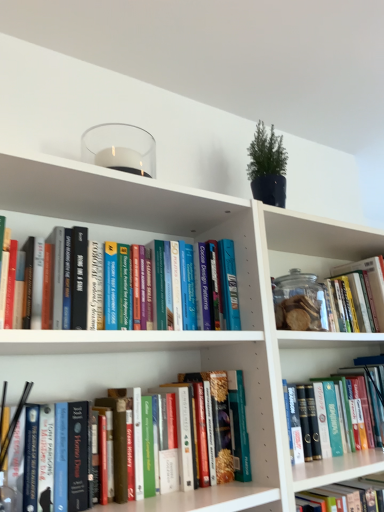
Measure the distance between hardcover book at center, which ranks as the third book in top-to-bottom order, and camera.

33.14 inches.

Locate an element on the screen. The height and width of the screenshot is (512, 384). hardcover book at lower right, which appears as the fifth book when viewed from the top is located at coordinates (352, 494).

Find the location of a particular element. white matte bookcase at upper center is located at coordinates (191, 331).

In order to face transparent glass jar at upper right, which is the second book in top-to-bottom order, should I rotate leftwards or rightwards?

You should rotate right by 18.265 degrees.

Locate an element on the screen. The height and width of the screenshot is (512, 384). hardcover book at center, positioned as the second book in bottom-to-top order is located at coordinates (313, 362).

The width and height of the screenshot is (384, 512). I want to click on hardcover book at center, which ranks as the third book in top-to-bottom order, so click(x=198, y=499).

Which is behind, hardcover book at lower right, which appears as the fifth book when viewed from the top, or transparent glass jar at upper right, the 4th book when ordered from bottom to top?

transparent glass jar at upper right, the 4th book when ordered from bottom to top, is behind.

From the image's perspective, which object appears higher, hardcover book at lower right, arranged as the 1th book when ordered from the bottom, or transparent glass jar at upper right, which is the second book in top-to-bottom order?

transparent glass jar at upper right, which is the second book in top-to-bottom order, from the image's perspective.

Does point (365, 497) come closer to viewer compared to point (310, 264)?

Yes.

Could you tell me if hardcover book at lower right, which appears as the fifth book when viewed from the top, is facing transparent glass jar at upper right, the 4th book when ordered from bottom to top?

No.

Is hardcover book at center, which is counted as the 4th book, starting from the top, wider or thinner than transparent glass jar at upper right, the 4th book when ordered from bottom to top?

Clearly, hardcover book at center, which is counted as the 4th book, starting from the top, has less width compared to transparent glass jar at upper right, the 4th book when ordered from bottom to top.

From a real-world perspective, starting from the transparent glass jar at upper right, the 4th book when ordered from bottom to top, which book is the 1st one below it? Please provide its 2D coordinates.

[(313, 362)]

In the scene shown: Which object is closer to the camera, hardcover book at center, which is counted as the 4th book, starting from the top, or transparent glass jar at upper right, the 4th book when ordered from bottom to top?

hardcover book at center, which is counted as the 4th book, starting from the top, is closer to the camera.

Is hardcover book at center, positioned as the second book in bottom-to-top order, far away from transparent glass jar at upper right, which is the second book in top-to-bottom order?

No, hardcover book at center, positioned as the second book in bottom-to-top order, is in close proximity to transparent glass jar at upper right, which is the second book in top-to-bottom order.

From a real-world perspective, which object rests below the other?

hardcover book at center, which ranks as the third book in top-to-bottom order, from a real-world perspective.

Consider the image. Is hardcover book at center, placed as the third book when sorted from bottom to top, aimed at white matte bookcase at upper center?

Yes, hardcover book at center, placed as the third book when sorted from bottom to top, faces towards white matte bookcase at upper center.

Is hardcover book at center, placed as the third book when sorted from bottom to top, far from white matte bookcase at upper center?

That's not correct — hardcover book at center, placed as the third book when sorted from bottom to top, is a little close to white matte bookcase at upper center.

Is hardcover book at center, which ranks as the third book in top-to-bottom order, bigger or smaller than white matte bookcase at upper center?

In the image, hardcover book at center, which ranks as the third book in top-to-bottom order, appears to be smaller than white matte bookcase at upper center.

You are a GUI agent. You are given a task and a screenshot of the screen. Output one action in this format:
    pyautogui.click(x=<x>, y=<y>)
    Task: Click on the 3rd book located beneath the white matte bookcase at upper center (from a real-world perspective)
    
    Given the screenshot: What is the action you would take?
    pyautogui.click(x=352, y=494)

From the image's perspective, is white matte bookcase at upper center above hardcover book at lower right, which appears as the fifth book when viewed from the top?

Yes, from the image's perspective, white matte bookcase at upper center is above hardcover book at lower right, which appears as the fifth book when viewed from the top.

From the picture: Is there a large distance between white matte bookcase at upper center and hardcover book at lower right, which appears as the fifth book when viewed from the top?

No, white matte bookcase at upper center is not far away from hardcover book at lower right, which appears as the fifth book when viewed from the top.

Can you confirm if white matte bookcase at upper center is positioned to the left of hardcover book at lower right, arranged as the 1th book when ordered from the bottom?

Correct, you'll find white matte bookcase at upper center to the left of hardcover book at lower right, arranged as the 1th book when ordered from the bottom.

From the image's perspective, is hardcover book at center, placed as the third book when sorted from bottom to top, on top of hardcover book at center, which is counted as the 4th book, starting from the top?

Correct, hardcover book at center, placed as the third book when sorted from bottom to top, appears higher than hardcover book at center, which is counted as the 4th book, starting from the top, in the image.

Is hardcover book at center, placed as the third book when sorted from bottom to top, with hardcover book at center, which is counted as the 4th book, starting from the top?

hardcover book at center, placed as the third book when sorted from bottom to top, and hardcover book at center, which is counted as the 4th book, starting from the top, are clearly separated.

Find the location of a particular element. The height and width of the screenshot is (512, 384). the 1st book above the hardcover book at center, positioned as the second book in bottom-to-top order (from the image's perspective) is located at coordinates (198, 499).

Is point (185, 388) positioned after point (347, 362)?

No, it is not.

Is transparent glass jar at upper right, the 4th book when ordered from bottom to top, not near hardcover book at lower right, which appears as the fifth book when viewed from the top?

They are positioned close to each other.

From the image's perspective, which object appears higher, transparent glass jar at upper right, the 4th book when ordered from bottom to top, or hardcover book at lower right, which appears as the fifth book when viewed from the top?

transparent glass jar at upper right, the 4th book when ordered from bottom to top, is shown above in the image.

From their relative heights in the image, would you say transparent glass jar at upper right, the 4th book when ordered from bottom to top, is taller or shorter than hardcover book at lower right, arranged as the 1th book when ordered from the bottom?

transparent glass jar at upper right, the 4th book when ordered from bottom to top, is taller than hardcover book at lower right, arranged as the 1th book when ordered from the bottom.

Can you confirm if transparent glass jar at upper right, the 4th book when ordered from bottom to top, is wider than hardcover book at lower right, which appears as the fifth book when viewed from the top?

Correct, the width of transparent glass jar at upper right, the 4th book when ordered from bottom to top, exceeds that of hardcover book at lower right, which appears as the fifth book when viewed from the top.

Is hardcover book at lower right, arranged as the 1th book when ordered from the bottom, a part of hardcover books at center, positioned as the first book in top-to-bottom order?

Definitely not — hardcover book at lower right, arranged as the 1th book when ordered from the bottom, is not inside hardcover books at center, positioned as the first book in top-to-bottom order.

The width and height of the screenshot is (384, 512). What are the coordinates of `book that is the 3rd one when counting leftward from the hardcover book at lower right, which appears as the fifth book when viewed from the top` in the screenshot? It's located at (32, 225).

Looking at this image, which is further, (90, 228) or (346, 487)?

The point (346, 487) is more distant.

Is hardcover books at center, positioned as the first book in top-to-bottom order, turned away from hardcover book at lower right, arranged as the 1th book when ordered from the bottom?

hardcover books at center, positioned as the first book in top-to-bottom order, is not turned away from hardcover book at lower right, arranged as the 1th book when ordered from the bottom.

Where is `the 3rd book positioned below the transparent glass jar at upper right, the 4th book when ordered from bottom to top (from a real-world perspective)`? the 3rd book positioned below the transparent glass jar at upper right, the 4th book when ordered from bottom to top (from a real-world perspective) is located at coordinates (352, 494).

From the image's perspective, starting from the hardcover book at center, which is counted as the 4th book, starting from the top, which book is the 2nd one above? Please provide its 2D coordinates.

[(301, 263)]

Estimate the real-world distances between objects in this image. Which object is further from hardcover books at center, which is the fifth book from bottom to top, hardcover book at center, positioned as the second book in bottom-to-top order, or transparent glass jar at center-right?

hardcover book at center, positioned as the second book in bottom-to-top order, is positioned further to the anchor hardcover books at center, which is the fifth book from bottom to top.

In the scene shown: From the image, which object appears to be farther from transparent glass jar at center-right, hardcover book at center, which ranks as the third book in top-to-bottom order, or transparent glass jar at upper right, the 4th book when ordered from bottom to top?

The object further to transparent glass jar at center-right is hardcover book at center, which ranks as the third book in top-to-bottom order.

Which object lies nearer to the anchor point hardcover book at center, which is counted as the 4th book, starting from the top, hardcover book at center, placed as the third book when sorted from bottom to top, or hardcover books at center, positioned as the first book in top-to-bottom order?

Among the two, hardcover book at center, placed as the third book when sorted from bottom to top, is located nearer to hardcover book at center, which is counted as the 4th book, starting from the top.

Which object lies nearer to the anchor point transparent glass jar at center-right, transparent glass jar at upper right, the 4th book when ordered from bottom to top, or hardcover book at center, which ranks as the third book in top-to-bottom order?

The object closer to transparent glass jar at center-right is transparent glass jar at upper right, the 4th book when ordered from bottom to top.

Estimate the real-world distances between objects in this image. Which object is further from hardcover books at center, which is the fifth book from bottom to top, white matte bookcase at upper center or hardcover book at center, which is counted as the 4th book, starting from the top?

hardcover book at center, which is counted as the 4th book, starting from the top.

Estimate the real-world distances between objects in this image. Which object is closer to transparent glass jar at upper right, the 4th book when ordered from bottom to top, hardcover books at center, which is the fifth book from bottom to top, or white matte bookcase at upper center?

white matte bookcase at upper center lies closer to transparent glass jar at upper right, the 4th book when ordered from bottom to top, than the other object.

In the scene shown: Looking at the image, which one is located closer to transparent glass jar at upper right, which is the second book in top-to-bottom order, hardcover books at center, which is the fifth book from bottom to top, or hardcover book at lower right, arranged as the 1th book when ordered from the bottom?

hardcover books at center, which is the fifth book from bottom to top, is closer to transparent glass jar at upper right, which is the second book in top-to-bottom order.

Based on their spatial positions, is hardcover books at center, positioned as the first book in top-to-bottom order, or transparent glass jar at upper right, which is the second book in top-to-bottom order, closer to transparent glass jar at center-right?

The object closer to transparent glass jar at center-right is transparent glass jar at upper right, which is the second book in top-to-bottom order.

I want to click on book between hardcover books at center, positioned as the first book in top-to-bottom order, and transparent glass jar at center-right from left to right, so click(x=198, y=499).

Find the location of a particular element. Image resolution: width=384 pixels, height=512 pixels. glass jar between hardcover books at center, which is the fifth book from bottom to top, and hardcover book at lower right, arranged as the 1th book when ordered from the bottom, from top to bottom is located at coordinates (299, 302).

Identify the location of glass jar between hardcover books at center, which is the fifth book from bottom to top, and transparent glass jar at upper right, the 4th book when ordered from bottom to top. (299, 302).

The width and height of the screenshot is (384, 512). What are the coordinates of `bookcase between hardcover book at center, placed as the third book when sorted from bottom to top, and hardcover book at lower right, which appears as the fifth book when viewed from the top, from left to right` in the screenshot? It's located at (191, 331).